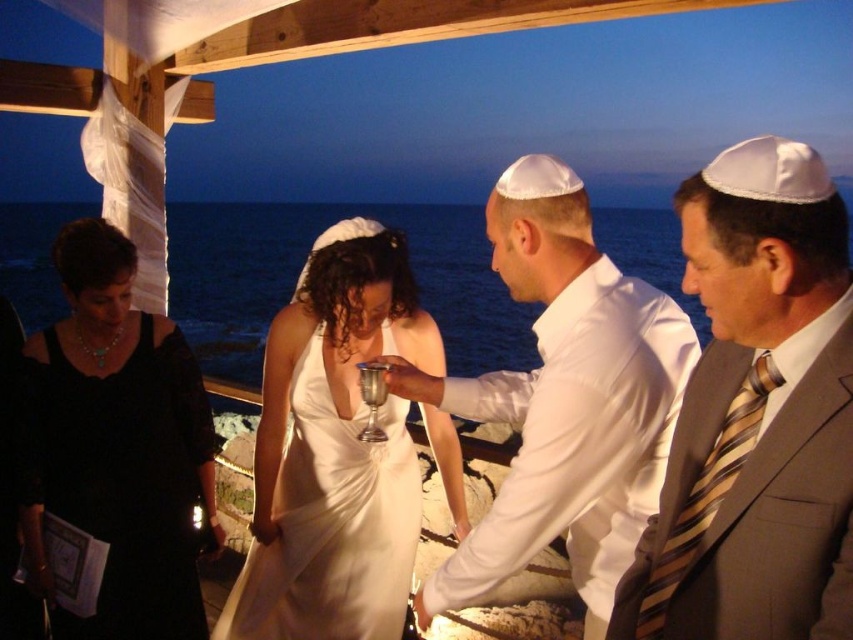
Question: Which object is closer to the camera taking this photo?

Choices:
 (A) white satin dress at center
 (B) white satin kippah at upper center
 (C) striped silk tie at right

Answer: (C)

Question: Which of these objects is positioned closest to the striped silk tie at right?

Choices:
 (A) black satin dress at lower left
 (B) white satin dress at center

Answer: (B)

Question: Which point is closer to the camera?

Choices:
 (A) (155, 564)
 (B) (563, 442)
 (C) (287, 605)

Answer: (B)

Question: Can you confirm if black satin dress at lower left is thinner than white satin dress at center?

Choices:
 (A) no
 (B) yes

Answer: (B)

Question: Does striped silk tie at right come in front of white satin dress at center?

Choices:
 (A) yes
 (B) no

Answer: (A)

Question: Is striped silk tie at right above white satin dress at center?

Choices:
 (A) no
 (B) yes

Answer: (B)